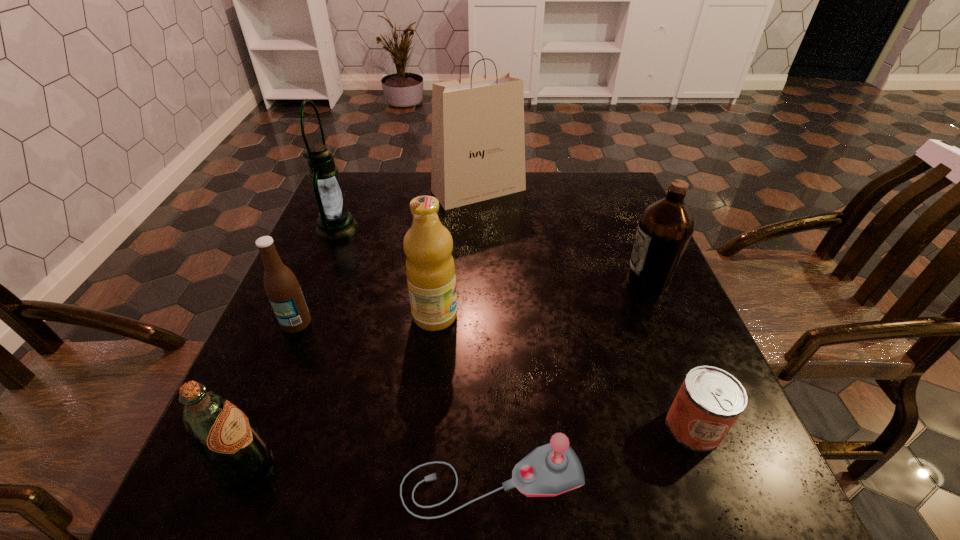
Locate an element on the screen. Image resolution: width=960 pixels, height=540 pixels. vacant space that is in between the farthest olive oil and the can is located at coordinates (671, 354).

Where is `empty location between the third farthest object and the farthest object`? The width and height of the screenshot is (960, 540). empty location between the third farthest object and the farthest object is located at coordinates (564, 235).

This screenshot has width=960, height=540. I want to click on empty space between the farthest object and the beer bottle, so click(388, 256).

Find the location of `free spot between the can and the nearest olive oil`. free spot between the can and the nearest olive oil is located at coordinates (468, 446).

You are a GUI agent. You are given a task and a screenshot of the screen. Output one action in this format:
    pyautogui.click(x=<x>, y=<y>)
    Task: Click on the free space between the third farthest object and the second nearest olive oil
    The image size is (960, 540).
    Given the screenshot: What is the action you would take?
    pyautogui.click(x=541, y=298)

You are a GUI agent. You are given a task and a screenshot of the screen. Output one action in this format:
    pyautogui.click(x=<x>, y=<y>)
    Task: Click on the vacant space that's between the second farthest object and the shopping bag
    Image resolution: width=960 pixels, height=540 pixels.
    Given the screenshot: What is the action you would take?
    pyautogui.click(x=408, y=209)

Where is `free space between the can and the beer bottle`? The height and width of the screenshot is (540, 960). free space between the can and the beer bottle is located at coordinates (495, 375).

Identify which object is located as the fifth nearest to the second nearest olive oil. Please provide its 2D coordinates. Your answer should be formatted as a tuple, i.e. [(x, y)], where the tuple contains the x and y coordinates of a point satisfying the conditions above.

[(478, 141)]

Locate which object ranks third in proximity to the joystick. Please provide its 2D coordinates. Your answer should be formatted as a tuple, i.e. [(x, y)], where the tuple contains the x and y coordinates of a point satisfying the conditions above.

[(430, 269)]

Identify which olive oil is the nearest to the beer bottle. Please provide its 2D coordinates. Your answer should be formatted as a tuple, i.e. [(x, y)], where the tuple contains the x and y coordinates of a point satisfying the conditions above.

[(430, 269)]